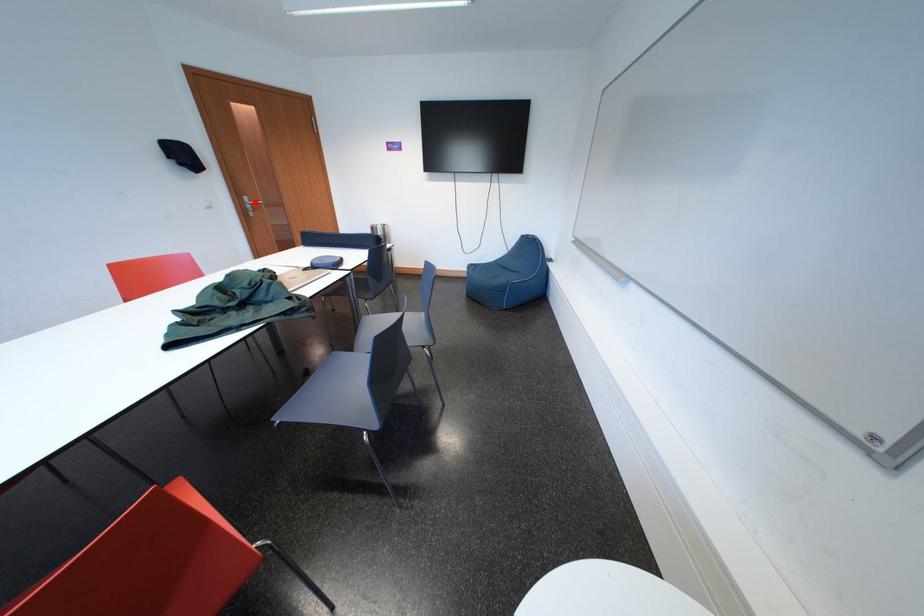
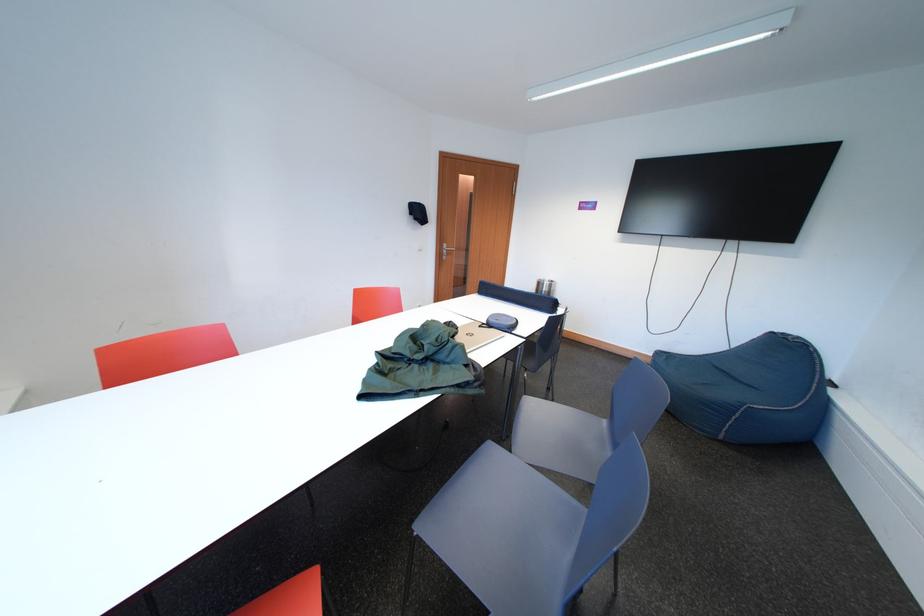
Locate, in the second image, the point that corresponds to the highlighted location in the first image.

(455, 249)